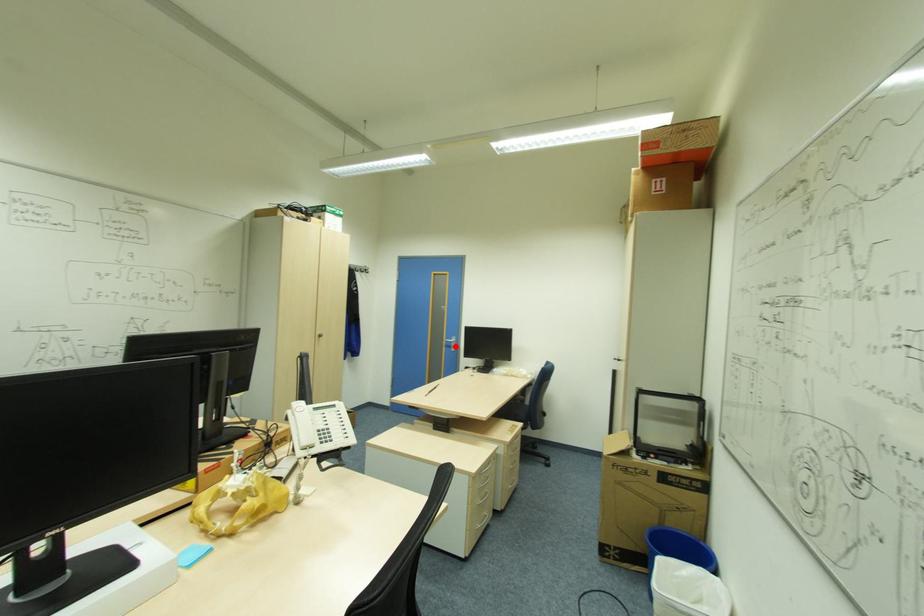
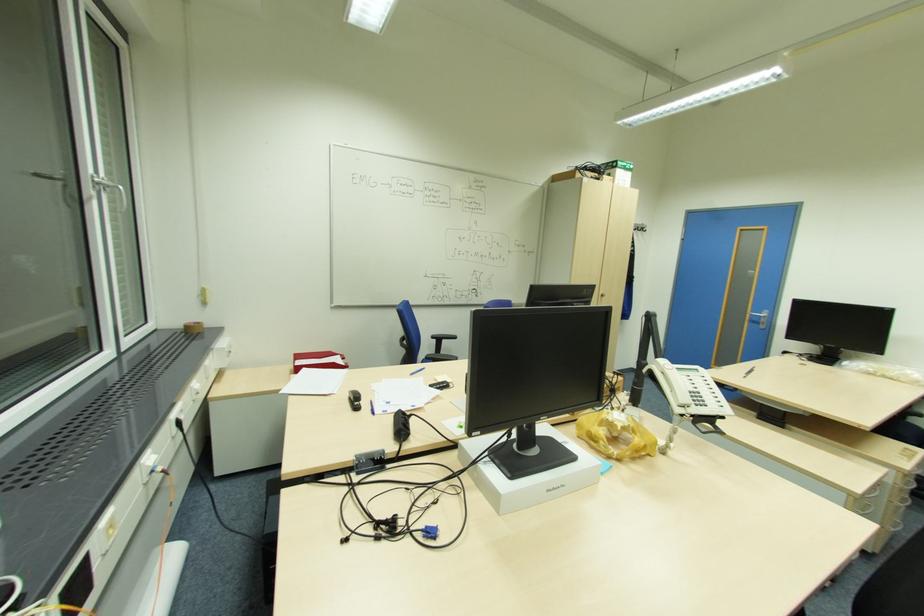
Locate, in the second image, the point that corresponds to the highlighted location in the first image.

(766, 323)